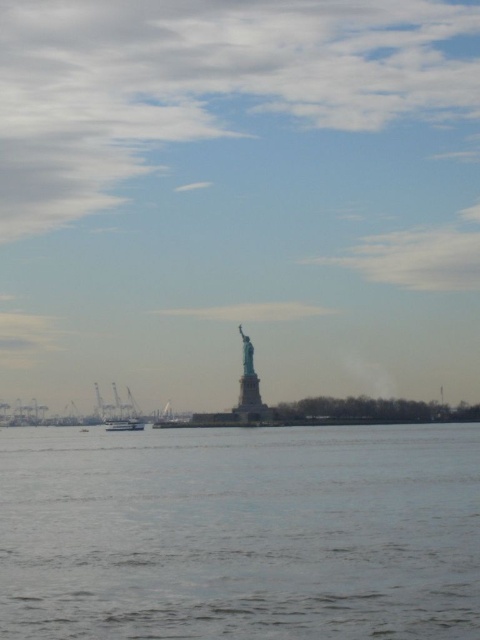
You are standing at the point with coordinates (x=123, y=413) in the image. What object is located exactly at this point?

The white glossy boat at lower left is located exactly at point (x=123, y=413).

You are a photographer planning to capture a wide shot of the Statue of Liberty. You want to ensure that both the white glossy boat at lower left and the white plastic boat at center are fully visible in your frame. Based on their sizes, which boat might require you to adjust your camera angle to include it entirely?

The white glossy boat at lower left might be wider than the white plastic boat at center, so you might need to adjust your camera angle to include the white glossy boat at lower left entirely.

You are a photographer planning to capture a shot of both the white glossy boat at lower left and the white plastic boat at center. Since you want to ensure both boats are visible in your frame, which boat should you focus on first to make sure they are both in the shot?

The white glossy boat at lower left is located above the white plastic boat at center, so you should focus on the white plastic boat at center first to ensure both are visible in the frame.